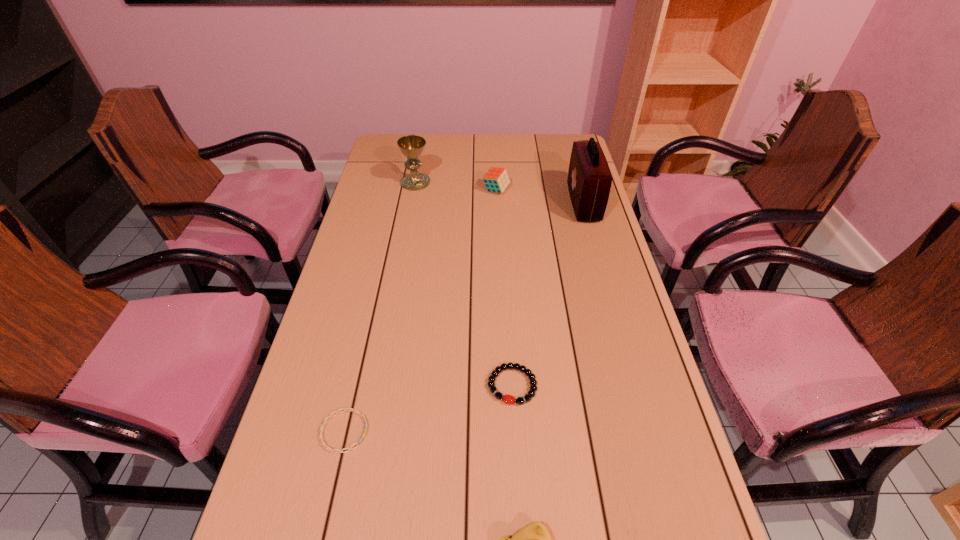
You are a GUI agent. You are given a task and a screenshot of the screen. Output one action in this format:
    pyautogui.click(x=<x>, y=<y>)
    Task: Click on the free space at the far left corner
    
    Given the screenshot: What is the action you would take?
    pyautogui.click(x=380, y=161)

Image resolution: width=960 pixels, height=540 pixels. Identify the location of vacant space at the far right corner of the desktop. (551, 152).

Identify the location of vacant area between the farther bracelet and the fifth shortest object. The width and height of the screenshot is (960, 540). (464, 284).

Locate an element on the screen. This screenshot has height=540, width=960. unoccupied position between the fourth farthest object and the first aid kit is located at coordinates (548, 294).

Find the location of a particular element. The height and width of the screenshot is (540, 960). vacant space in between the chalice and the shortest object is located at coordinates (380, 307).

Locate an element on the screen. Image resolution: width=960 pixels, height=540 pixels. free space between the cube and the second tallest object is located at coordinates (456, 187).

You are a GUI agent. You are given a task and a screenshot of the screen. Output one action in this format:
    pyautogui.click(x=<x>, y=<y>)
    Task: Click on the free space that is in between the farther bracelet and the rightmost object
    
    Given the screenshot: What is the action you would take?
    pyautogui.click(x=548, y=294)

I want to click on unoccupied position between the nearer bracelet and the second shortest object, so click(428, 408).

Where is `free point between the second tallest object and the tallest object`? The image size is (960, 540). free point between the second tallest object and the tallest object is located at coordinates (499, 193).

Find the location of a particular element. This screenshot has width=960, height=540. object that is the second closest to the first aid kit is located at coordinates (411, 146).